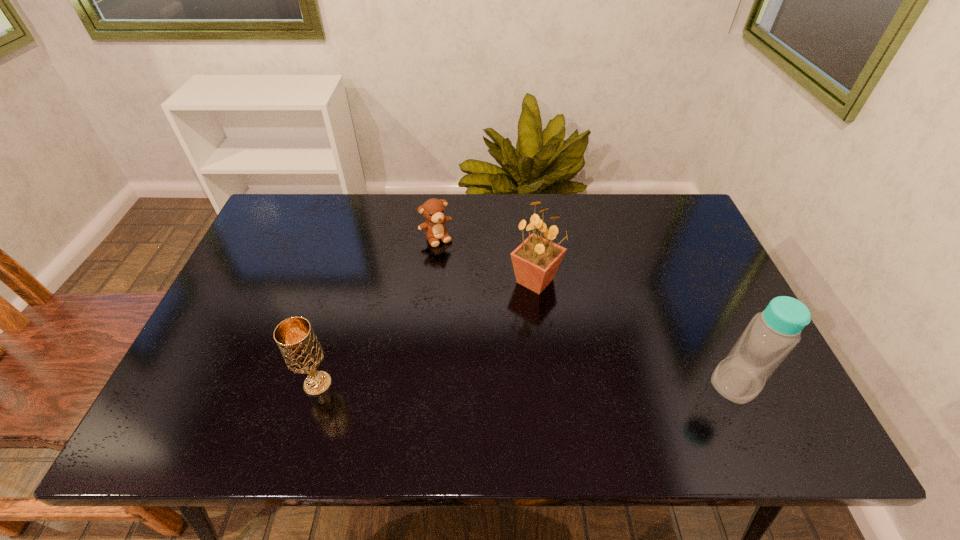
You are a GUI agent. You are given a task and a screenshot of the screen. Output one action in this format:
    pyautogui.click(x=<x>, y=<y>)
    Task: Click on the vacant space on the desktop that is between the chalice and the rightmost object and is positioned at the front of the sunflower with flowers visible
    The width and height of the screenshot is (960, 540).
    Given the screenshot: What is the action you would take?
    pyautogui.click(x=565, y=383)

Image resolution: width=960 pixels, height=540 pixels. I want to click on vacant spot on the desktop that is between the second shortest object and the rightmost object and is positioned on the face of the second object from left to right, so click(x=531, y=383).